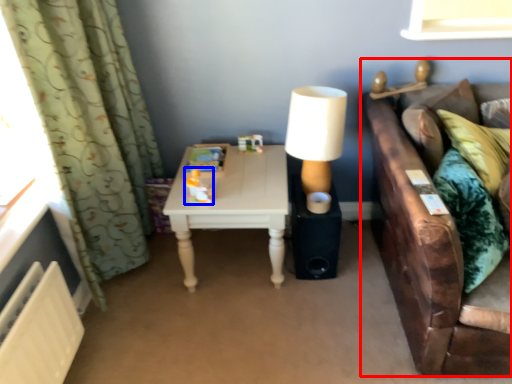
Question: Which object appears farthest to the camera in this image, studio couch (highlighted by a red box) or toy (highlighted by a blue box)?

Choices:
 (A) studio couch
 (B) toy

Answer: (B)